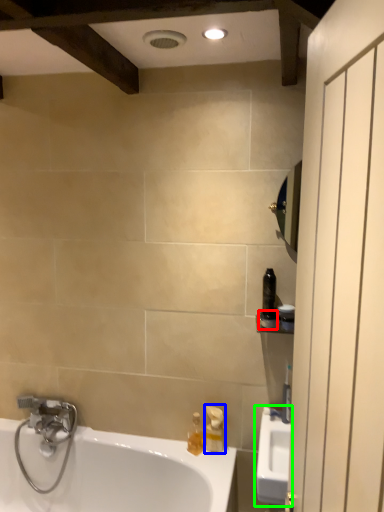
Question: Based on their relative distances, which object is farther from toiletry (highlighted by a red box)? Choose from soap dispenser (highlighted by a blue box) and sink (highlighted by a green box).

Choices:
 (A) soap dispenser
 (B) sink

Answer: (A)